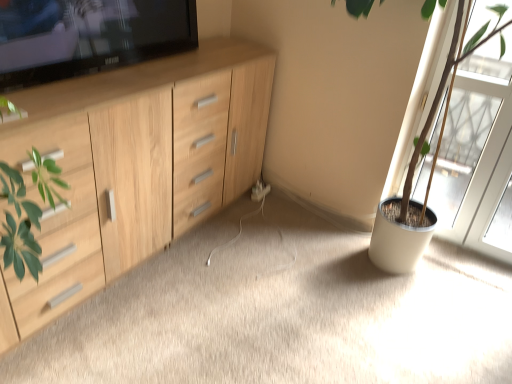
Question: Is white plastic electric outlet at center wider or thinner than wooden cabinet at left?

Choices:
 (A) thin
 (B) wide

Answer: (A)

Question: Would you say white plastic electric outlet at center is inside or outside wooden cabinet at left?

Choices:
 (A) outside
 (B) inside

Answer: (B)

Question: Estimate the real-world distances between objects in this image. Which object is farther from the green matte plant pot at right?

Choices:
 (A) light wood cabinet at left
 (B) wooden cabinet at left
 (C) transparent glass screen door at right
 (D) white plastic electric outlet at center

Answer: (A)

Question: Which is farther from the green matte plant pot at right?

Choices:
 (A) transparent glass screen door at right
 (B) light wood cabinet at left
 (C) white plastic electric outlet at center
 (D) wooden cabinet at left

Answer: (B)